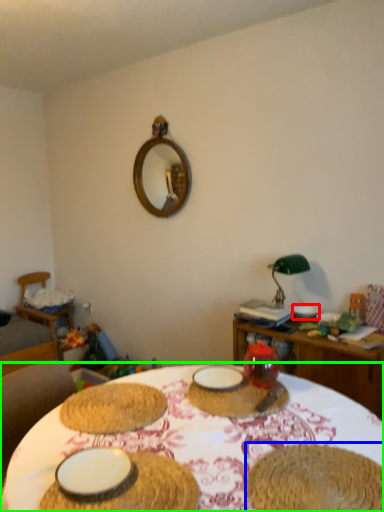
Question: Which object is positioned closest to tableware (highlighted by a red box)? Select from food (highlighted by a blue box) and table (highlighted by a green box).

Choices:
 (A) food
 (B) table

Answer: (B)